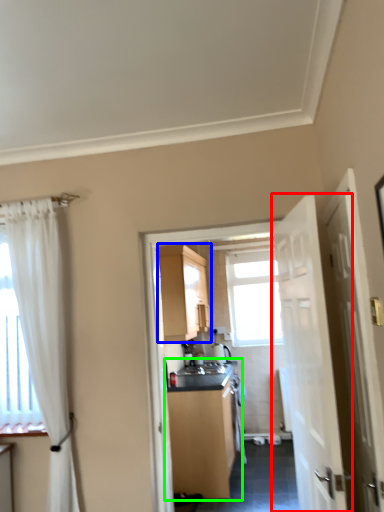
Question: Which is farther away from door (highlighted by a red box)? cabinetry (highlighted by a blue box) or cabinetry (highlighted by a green box)?

Choices:
 (A) cabinetry
 (B) cabinetry

Answer: (A)